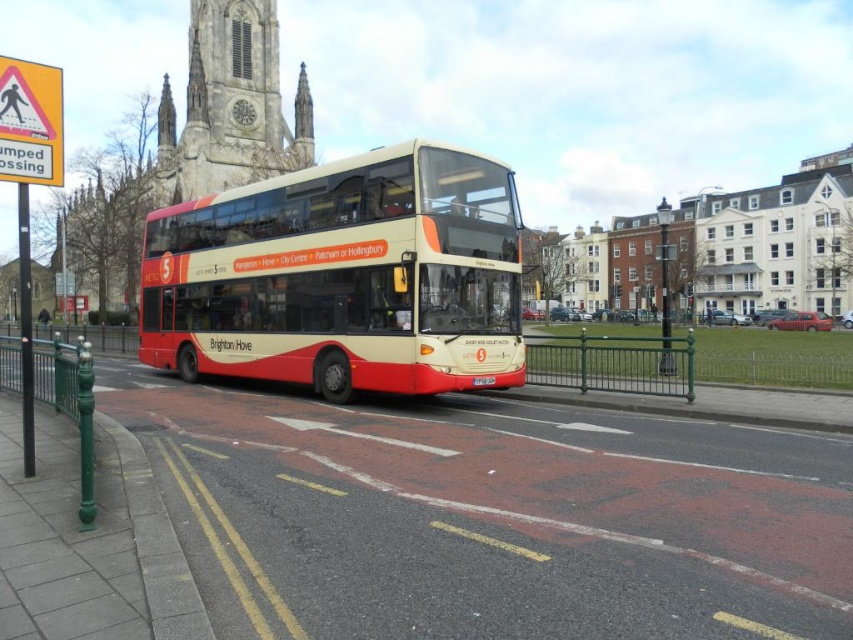
Can you confirm if green metal fence at lower center is positioned to the left of yellow plastic pedestrian crossing sign at upper left?

No, green metal fence at lower center is not to the left of yellow plastic pedestrian crossing sign at upper left.

Image resolution: width=853 pixels, height=640 pixels. What do you see at coordinates (612, 362) in the screenshot?
I see `green metal fence at lower center` at bounding box center [612, 362].

This screenshot has height=640, width=853. I want to click on green metal fence at lower center, so click(x=612, y=362).

Who is positioned more to the left, matte beige-decked bus at center or white plastic license plate at center?

matte beige-decked bus at center is more to the left.

Is matte beige-decked bus at center to the right of white plastic license plate at center from the viewer's perspective?

In fact, matte beige-decked bus at center is to the left of white plastic license plate at center.

Is point (186, 248) closer to viewer compared to point (483, 378)?

No, (186, 248) is further to viewer.

At what (x,y) coordinates should I click in order to perform the action: click on matte beige-decked bus at center. Please return your answer as a coordinate pair (x, y). Looking at the image, I should click on (343, 276).

Who is taller, yellow plastic pedestrian crossing sign at upper left or white plastic license plate at center?

yellow plastic pedestrian crossing sign at upper left

Can you confirm if yellow plastic pedestrian crossing sign at upper left is positioned to the left of white plastic license plate at center?

Indeed, yellow plastic pedestrian crossing sign at upper left is positioned on the left side of white plastic license plate at center.

This screenshot has width=853, height=640. Identify the location of yellow plastic pedestrian crossing sign at upper left. point(30,122).